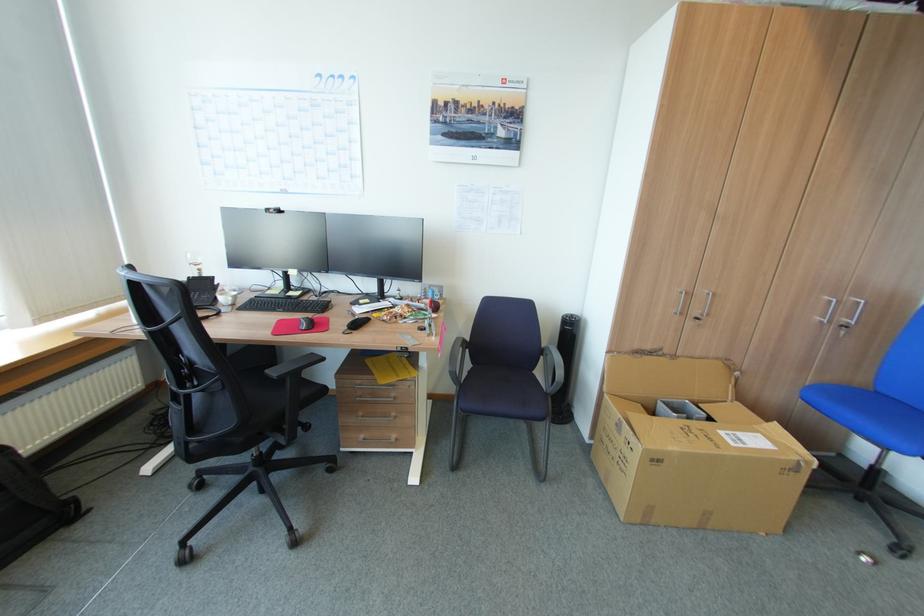
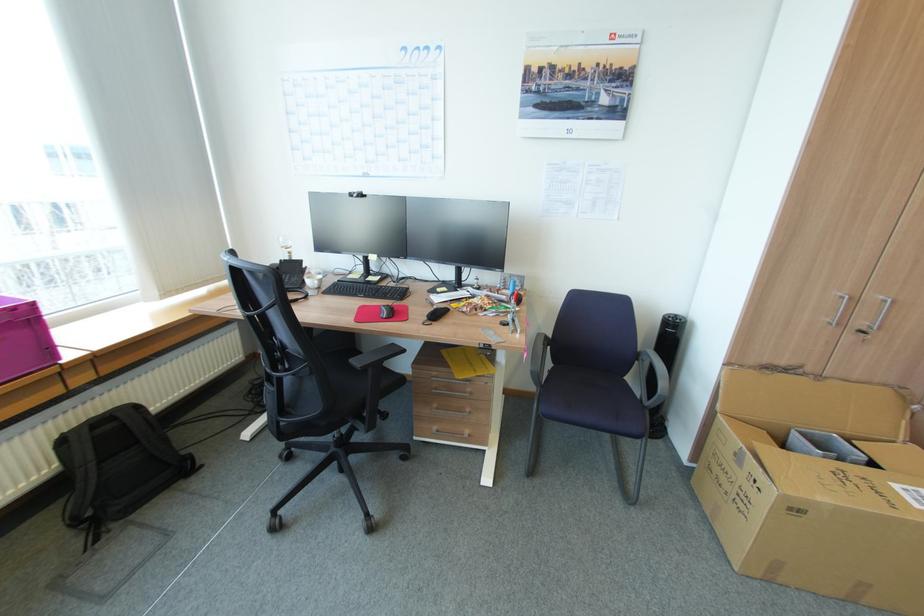
The point at (548, 346) is marked in the first image. Where is the corresponding point in the second image?

(643, 350)